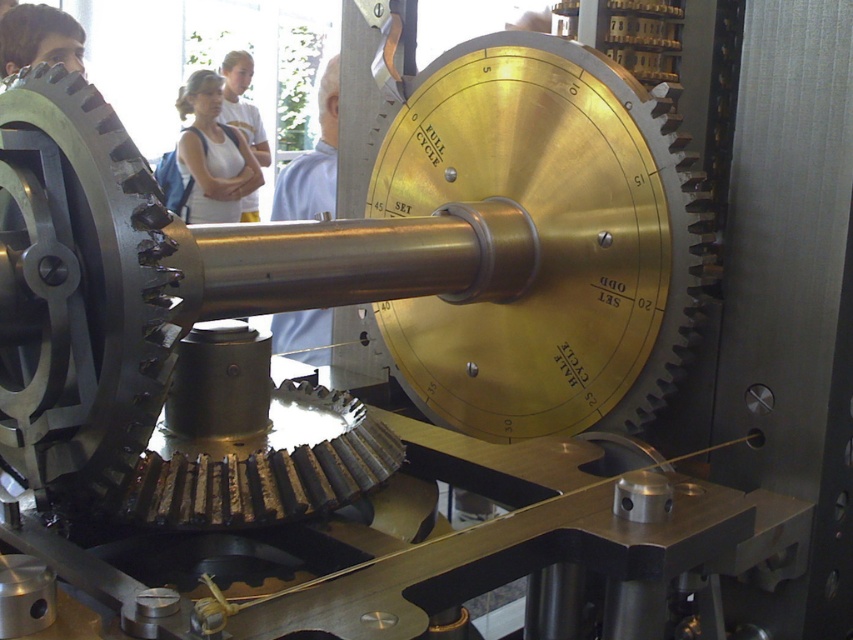
Question: From the image, what is the correct spatial relationship of white cotton shirt at upper left in relation to matte black gear at upper left?

Choices:
 (A) below
 (B) above

Answer: (A)

Question: Does white shirt at upper center have a lesser width compared to matte black gear at upper left?

Choices:
 (A) yes
 (B) no

Answer: (B)

Question: Based on their relative distances, which object is farther from the white cotton shirt at upper center?

Choices:
 (A) white cotton shirt at upper left
 (B) matte black gear at upper left

Answer: (B)

Question: Among these points, which one is nearest to the camera?

Choices:
 (A) (44, 6)
 (B) (227, 108)

Answer: (A)

Question: Is the position of white shirt at upper center less distant than that of white cotton shirt at upper left?

Choices:
 (A) yes
 (B) no

Answer: (A)

Question: Which object is the farthest from the white shirt at upper center?

Choices:
 (A) white cotton shirt at upper center
 (B) white cotton shirt at upper left

Answer: (A)